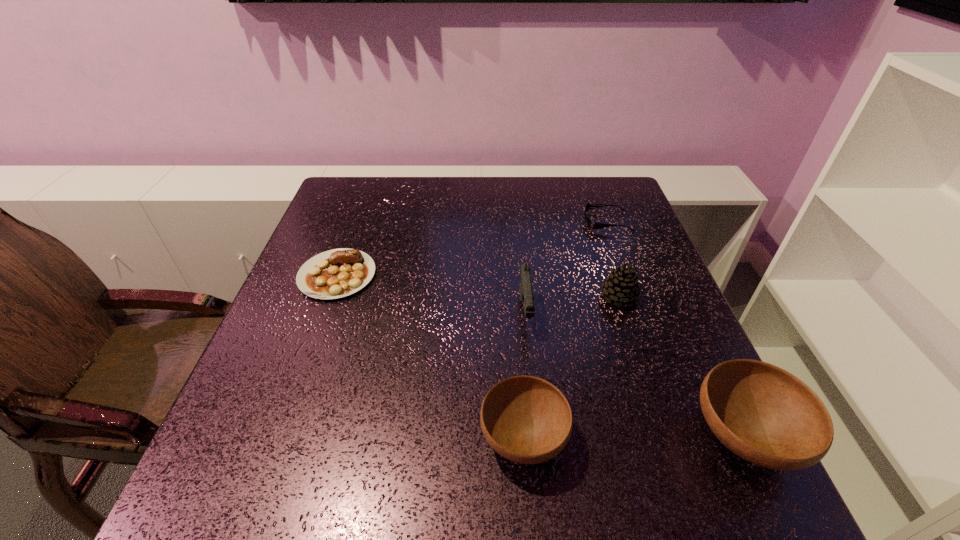
Locate an element on the screen. This screenshot has width=960, height=540. empty space between the shorter bowl and the pinecone is located at coordinates (571, 368).

You are a GUI agent. You are given a task and a screenshot of the screen. Output one action in this format:
    pyautogui.click(x=<x>, y=<y>)
    Task: Click on the blank region between the left bowl and the taller bowl
    
    Given the screenshot: What is the action you would take?
    pyautogui.click(x=634, y=437)

Choose which object is the second nearest neighbor to the steak. Please provide its 2D coordinates. Your answer should be formatted as a tuple, i.e. [(x, y)], where the tuple contains the x and y coordinates of a point satisfying the conditions above.

[(526, 419)]

Select which object is the third closest to the pistol. Please provide its 2D coordinates. Your answer should be formatted as a tuple, i.e. [(x, y)], where the tuple contains the x and y coordinates of a point satisfying the conditions above.

[(762, 413)]

Find the location of a particular element. This screenshot has width=960, height=540. free region that satisfies the following two spatial constraints: 1. on the front-facing side of the sunglasses; 2. on the left side of the right bowl is located at coordinates (687, 437).

Locate an element on the screen. The width and height of the screenshot is (960, 540). free space that satisfies the following two spatial constraints: 1. at the barrel of the taller bowl; 2. on the right side of the pistol is located at coordinates (538, 437).

I want to click on free location that satisfies the following two spatial constraints: 1. at the barrel of the pistol; 2. on the right side of the right bowl, so click(538, 437).

The image size is (960, 540). I want to click on vacant area in the image that satisfies the following two spatial constraints: 1. at the narrow end of the right bowl; 2. on the right side of the pinecone, so click(x=665, y=437).

Identify the location of free space in the image that satisfies the following two spatial constraints: 1. at the barrel of the pistol; 2. on the left side of the right bowl. This screenshot has width=960, height=540. coord(538,437).

You are a GUI agent. You are given a task and a screenshot of the screen. Output one action in this format:
    pyautogui.click(x=<x>, y=<y>)
    Task: Click on the free space that satisfies the following two spatial constraints: 1. at the narrow end of the pinecone; 2. on the left side of the right bowl
    
    Given the screenshot: What is the action you would take?
    pyautogui.click(x=665, y=437)